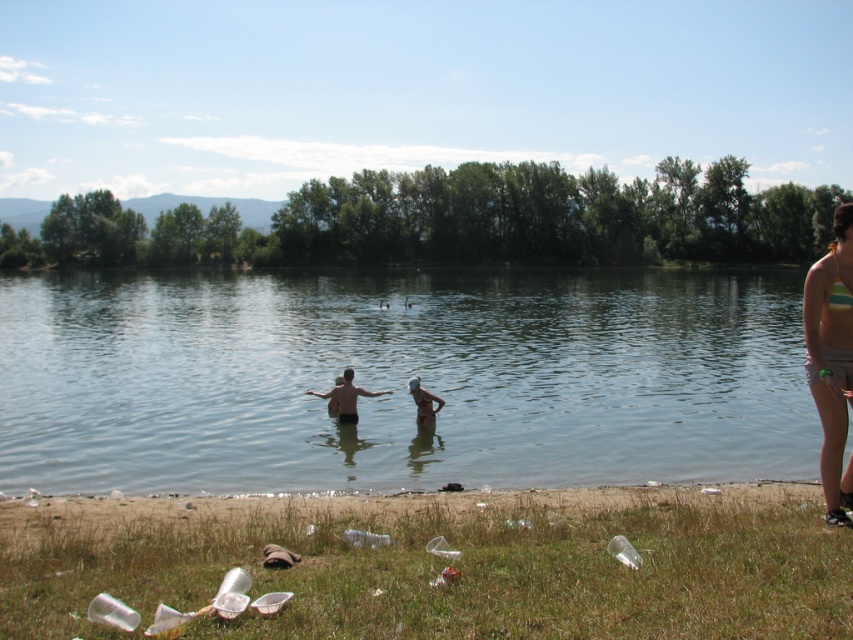
Does clear water at center appear under white matte swim cap at upper center?

Actually, clear water at center is above white matte swim cap at upper center.

Which is above, clear water at center or white matte swim cap at upper center?

clear water at center is higher up.

Is point (254, 301) farther from viewer compared to point (419, 404)?

Yes, point (254, 301) is farther from viewer.

Identify the location of clear water at center. Image resolution: width=853 pixels, height=640 pixels. (399, 378).

Is point (33, 388) positioned in front of point (793, 518)?

No, it is not.

Is point (643, 275) more distant than point (193, 522)?

That is True.

The height and width of the screenshot is (640, 853). I want to click on clear water at center, so click(399, 378).

Is grassy shore at lower left below striped bikini top at lower right?

Yes, grassy shore at lower left is below striped bikini top at lower right.

Can you confirm if grassy shore at lower left is shorter than striped bikini top at lower right?

Correct, grassy shore at lower left is not as tall as striped bikini top at lower right.

Does point (22, 524) come farther from viewer compared to point (845, 381)?

Yes, point (22, 524) is farther from viewer.

The image size is (853, 640). I want to click on grassy shore at lower left, so click(x=392, y=515).